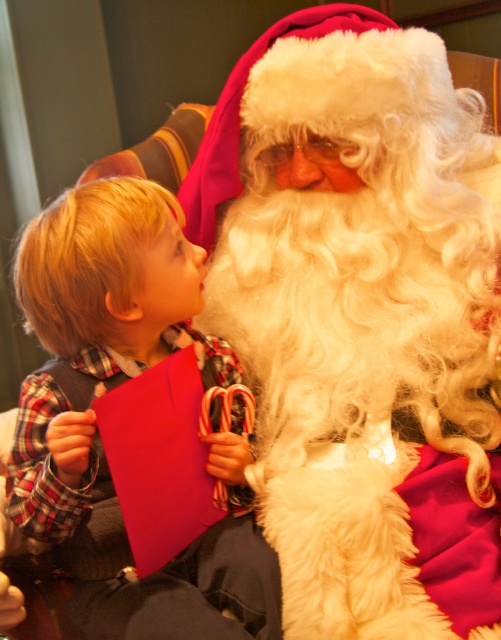
You are a tailor measuring fabrics for a costume. You have a piece of fabric that is 1.2 meters wide. You need to decide whether to use it for the white fluffy beard at center or the plaid fabric shirt at left. Which one requires a wider fabric piece?

The white fluffy beard at center requires a wider fabric piece since its width surpasses that of the plaid fabric shirt at left.

You are a photographer trying to capture the perfect shot of Santa Claus. You need to ensure the white fluffy beard at center is in focus. Based on its position, where should you aim the camera lens?

The white fluffy beard at center is located at point (x=362, y=321), so you should aim the camera lens directly at those coordinates to ensure it is in focus.